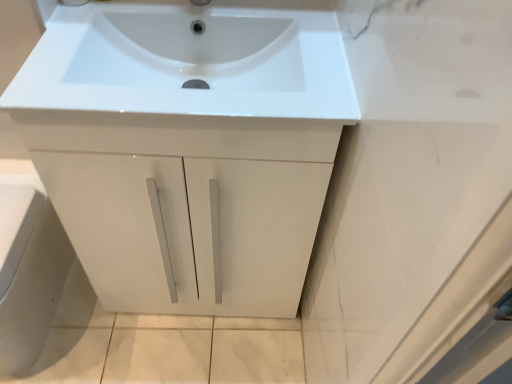
Describe the element at coordinates (29, 273) in the screenshot. This screenshot has height=384, width=512. I see `white glossy cabinet door at lower left` at that location.

Measure the distance between point (60, 223) and camera.

Point (60, 223) is 1.34 meters from camera.

Locate an element on the screen. The width and height of the screenshot is (512, 384). white glossy cabinet door at lower left is located at coordinates (29, 273).

What are the coordinates of `white glossy sink at center` in the screenshot? It's located at (188, 63).

What do you see at coordinates (188, 63) in the screenshot? The width and height of the screenshot is (512, 384). I see `white glossy sink at center` at bounding box center [188, 63].

Locate an element on the screen. This screenshot has height=384, width=512. white glossy cabinet door at lower left is located at coordinates (29, 273).

From the picture: Between white glossy cabinet door at lower left and white glossy sink at center, which one appears on the right side from the viewer's perspective?

white glossy sink at center is more to the right.

Does white glossy cabinet door at lower left lie in front of white glossy sink at center?

That is False.

Is point (20, 281) closer or farther from the camera than point (193, 75)?

Point (20, 281) is positioned farther from the camera compared to point (193, 75).

From the image's perspective, is white glossy cabinet door at lower left below white glossy sink at center?

Correct, white glossy cabinet door at lower left appears lower than white glossy sink at center in the image.

From a real-world perspective, is white glossy cabinet door at lower left below white glossy sink at center?

Yes, from a real-world perspective, white glossy cabinet door at lower left is beneath white glossy sink at center.

Considering the sizes of objects white glossy cabinet door at lower left and white glossy sink at center in the image provided, who is wider, white glossy cabinet door at lower left or white glossy sink at center?

white glossy cabinet door at lower left.

Between white glossy cabinet door at lower left and white glossy sink at center, which one has more height?

white glossy cabinet door at lower left is taller.

Looking at the image, does white glossy cabinet door at lower left seem bigger or smaller compared to white glossy sink at center?

In the image, white glossy cabinet door at lower left appears to be larger than white glossy sink at center.

Is white glossy sink at center completely or partially inside white glossy cabinet door at lower left?

Actually, white glossy sink at center is outside white glossy cabinet door at lower left.

Looking at this image, would you consider white glossy cabinet door at lower left to be distant from white glossy sink at center?

No, white glossy cabinet door at lower left is not far away from white glossy sink at center.

Is white glossy cabinet door at lower left looking in the opposite direction of white glossy sink at center?

That's not correct — white glossy cabinet door at lower left is not looking away from white glossy sink at center.

I want to click on sink above the white glossy cabinet door at lower left (from the image's perspective), so click(x=188, y=63).

Which is more to the left, white glossy sink at center or white glossy cabinet door at lower left?

white glossy cabinet door at lower left.

In the image, is white glossy sink at center positioned in front of or behind white glossy cabinet door at lower left?

white glossy sink at center is in front of white glossy cabinet door at lower left.

Between point (308, 89) and point (10, 255), which one is positioned behind?

Positioned behind is point (10, 255).

In the scene shown: From the image's perspective, which object appears higher, white glossy sink at center or white glossy cabinet door at lower left?

white glossy sink at center, from the image's perspective.

From a real-world perspective, is white glossy sink at center physically above white glossy cabinet door at lower left?

Yes, from a real-world perspective, white glossy sink at center is above white glossy cabinet door at lower left.

Which object is thinner, white glossy sink at center or white glossy cabinet door at lower left?

white glossy sink at center is thinner.

Who is shorter, white glossy sink at center or white glossy cabinet door at lower left?

white glossy sink at center.

Is white glossy sink at center bigger or smaller than white glossy cabinet door at lower left?

Considering their sizes, white glossy sink at center takes up less space than white glossy cabinet door at lower left.

Would you say white glossy sink at center is outside white glossy cabinet door at lower left?

Yes, white glossy sink at center is outside of white glossy cabinet door at lower left.

Is white glossy sink at center directly adjacent to white glossy cabinet door at lower left?

There is a gap between white glossy sink at center and white glossy cabinet door at lower left.

Is white glossy sink at center positioned with its back to white glossy cabinet door at lower left?

No.

Can you tell me how much white glossy sink at center and white glossy cabinet door at lower left differ in facing direction?

There is a 1.75-degree angle between the facing directions of white glossy sink at center and white glossy cabinet door at lower left.

Locate an element on the screen. Image resolution: width=512 pixels, height=384 pixels. porcelain located underneath the white glossy sink at center (from a real-world perspective) is located at coordinates (29, 273).

The height and width of the screenshot is (384, 512). Identify the location of porcelain that appears behind the white glossy sink at center. (29, 273).

The height and width of the screenshot is (384, 512). What are the coordinates of `porcelain that appears below the white glossy sink at center (from the image's perspective)` in the screenshot? It's located at (29, 273).